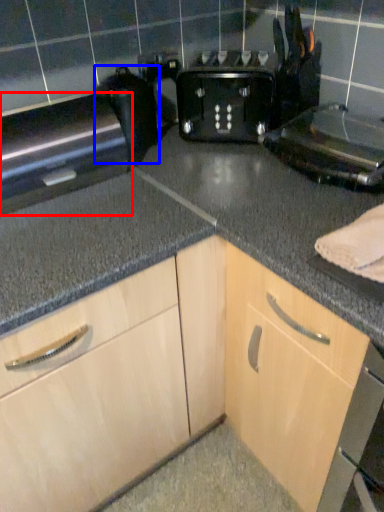
Question: Among these objects, which one is farthest to the camera, appliance (highlighted by a red box) or appliance (highlighted by a blue box)?

Choices:
 (A) appliance
 (B) appliance

Answer: (B)